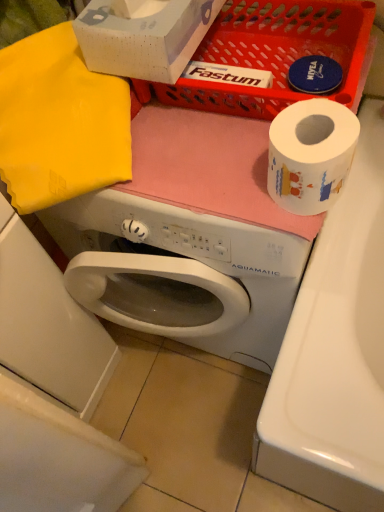
Where is `free spot above white matte washing machine at center (from a real-world perspective)`? Image resolution: width=384 pixels, height=512 pixels. free spot above white matte washing machine at center (from a real-world perspective) is located at coordinates (199, 147).